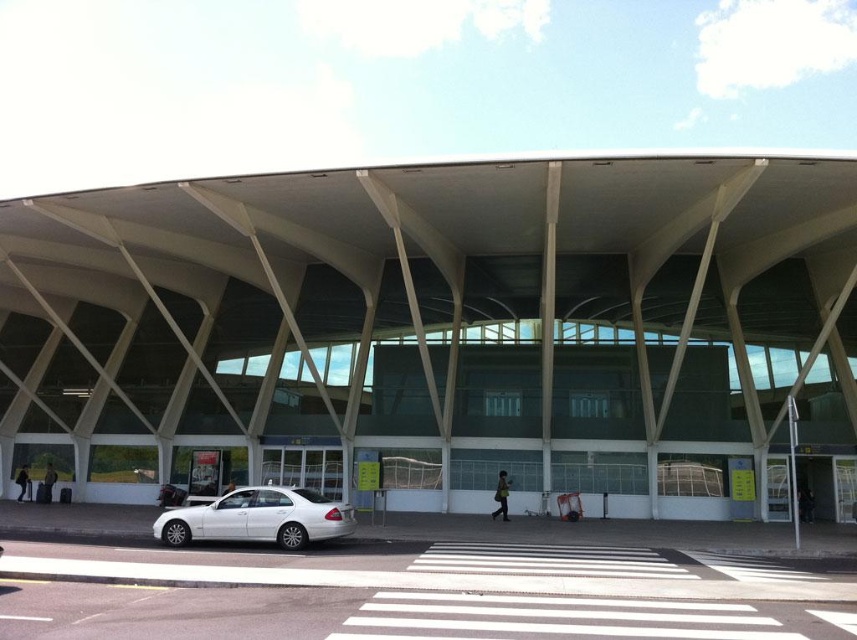
Who is more distant from viewer, (112, 492) or (250, 528)?

The point (112, 492) is more distant.

Image resolution: width=857 pixels, height=640 pixels. Identify the location of matte white building at center. (442, 321).